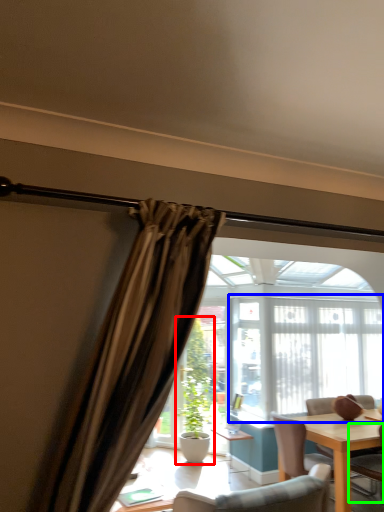
Question: Estimate the real-world distances between objects in this image. Which object is farther from houseplant (highlighted by a red box), window frame (highlighted by a blue box) or chair (highlighted by a green box)?

Choices:
 (A) window frame
 (B) chair

Answer: (B)